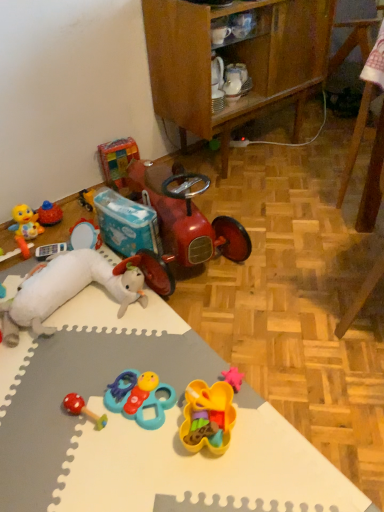
Where is `free space in front of wooden cabinet at center`? This screenshot has width=384, height=512. free space in front of wooden cabinet at center is located at coordinates (283, 203).